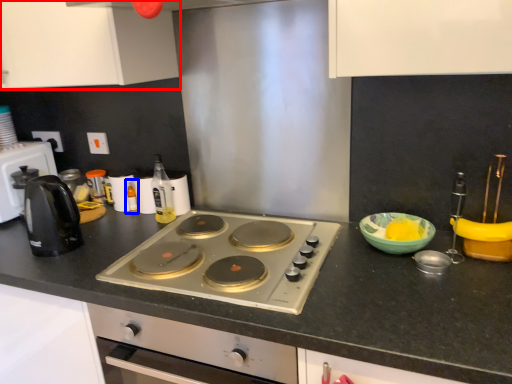
Question: Among these objects, which one is farthest to the camera, cabinetry (highlighted by a red box) or bottle (highlighted by a blue box)?

Choices:
 (A) cabinetry
 (B) bottle

Answer: (B)